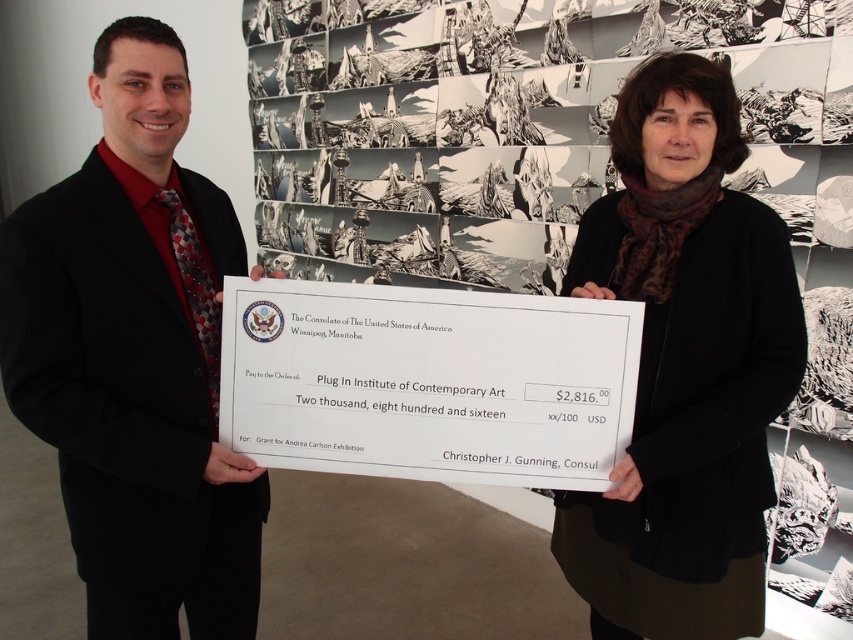
Can you confirm if black suit at center is positioned above black woolen sweater at center?

Indeed, black suit at center is positioned over black woolen sweater at center.

Can you confirm if black suit at center is shorter than black woolen sweater at center?

No, black suit at center is not shorter than black woolen sweater at center.

Who is more forward, (x=96, y=476) or (x=653, y=349)?

Point (x=96, y=476)

The width and height of the screenshot is (853, 640). Find the location of `black suit at center`. black suit at center is located at coordinates (135, 356).